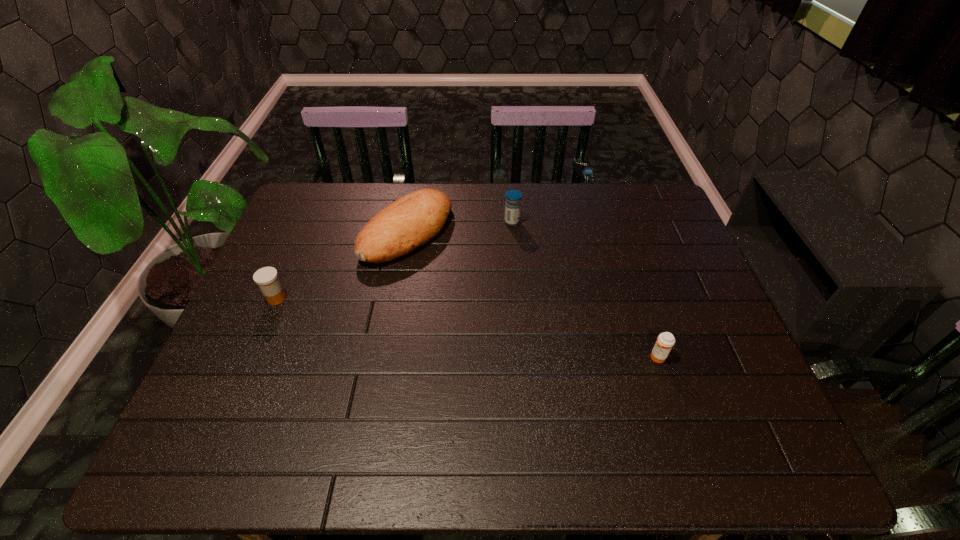
You are a GUI agent. You are given a task and a screenshot of the screen. Output one action in this format:
    pyautogui.click(x=<x>, y=<y>)
    Task: Click on the vacant area between the bread and the second medicine from right to left
    
    Given the screenshot: What is the action you would take?
    pyautogui.click(x=460, y=227)

Identify which object is the third nearest to the nearest medicine. Please provide its 2D coordinates. Your answer should be formatted as a tuple, i.e. [(x, y)], where the tuple contains the x and y coordinates of a point satisfying the conditions above.

[(267, 277)]

You are a GUI agent. You are given a task and a screenshot of the screen. Output one action in this format:
    pyautogui.click(x=<x>, y=<y>)
    Task: Click on the closest object to the third object from left to right
    This screenshot has width=960, height=540.
    Given the screenshot: What is the action you would take?
    pyautogui.click(x=409, y=222)

The height and width of the screenshot is (540, 960). I want to click on medicine that is the closest to the nearest object, so click(x=513, y=198).

Locate an element on the screen. This screenshot has width=960, height=540. medicine object that ranks as the second closest to the third object from left to right is located at coordinates (267, 277).

I want to click on vacant space that satisfies the following two spatial constraints: 1. on the back side of the nearest object; 2. on the label of the third farthest object, so click(637, 299).

Image resolution: width=960 pixels, height=540 pixels. I want to click on vacant area in the image that satisfies the following two spatial constraints: 1. on the front side of the second medicine from left to right; 2. on the label of the second nearest object, so click(x=518, y=299).

This screenshot has height=540, width=960. In order to click on vacant area that satisfies the following two spatial constraints: 1. on the back side of the nearest object; 2. on the label of the third farthest object in this screenshot , I will do `click(637, 299)`.